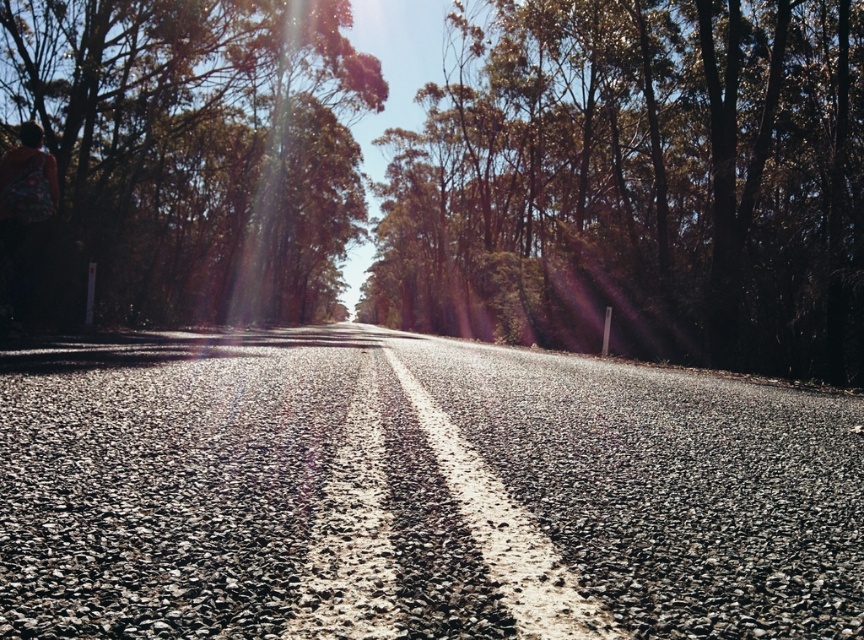
Is green leafy trees at center to the right of green leafy tree at left from the viewer's perspective?

Indeed, green leafy trees at center is positioned on the right side of green leafy tree at left.

Is green leafy trees at center in front of green leafy tree at left?

No, green leafy trees at center is behind green leafy tree at left.

What do you see at coordinates (638, 182) in the screenshot? The image size is (864, 640). I see `green leafy trees at center` at bounding box center [638, 182].

The image size is (864, 640). Find the location of `green leafy trees at center`. green leafy trees at center is located at coordinates (638, 182).